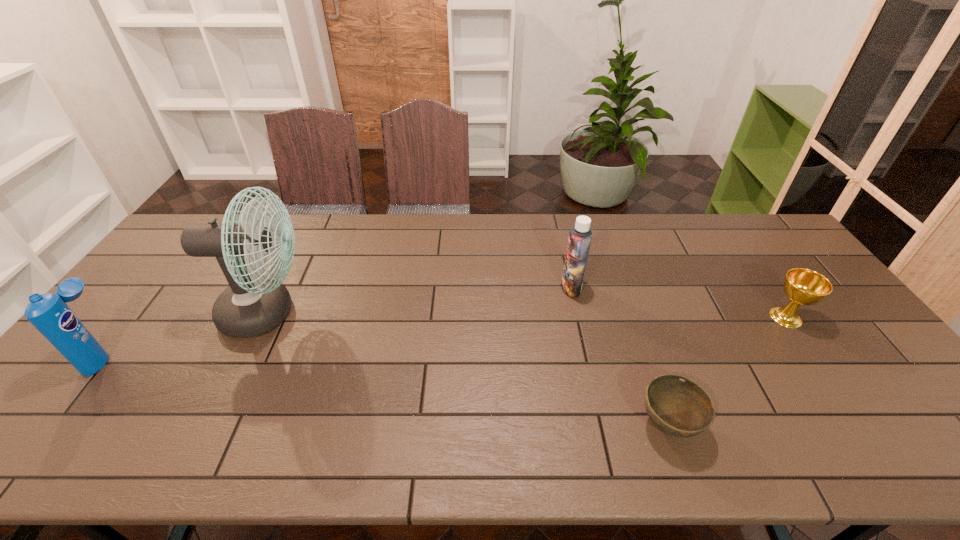
Find the location of a particular element. The image size is (960, 540). vacant space that satisfies the following two spatial constraints: 1. on the front label of the farther shampoo; 2. on the front side of the leftmost object is located at coordinates [x=587, y=355].

At what (x,y) coordinates should I click in order to perform the action: click on free region that satisfies the following two spatial constraints: 1. in front of the fan where the airflow is directed; 2. on the back side of the nearest object. Please return your answer as a coordinate pair (x, y). This screenshot has width=960, height=540. Looking at the image, I should click on (211, 424).

You are a GUI agent. You are given a task and a screenshot of the screen. Output one action in this format:
    pyautogui.click(x=<x>, y=<y>)
    Task: Click on the vacant space that satisfies the following two spatial constraints: 1. in front of the rightmost object where the airflow is directed; 2. on the left side of the tallest object
    The width and height of the screenshot is (960, 540).
    Given the screenshot: What is the action you would take?
    pyautogui.click(x=264, y=317)